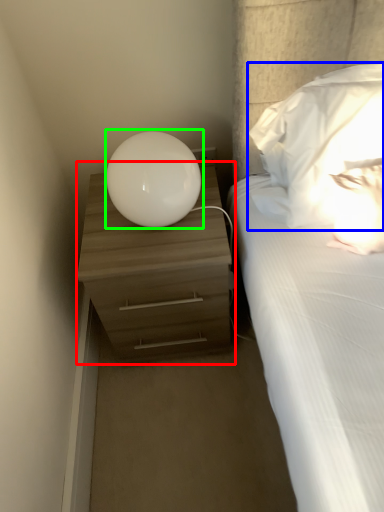
Question: Considering the real-world distances, which object is closest to nightstand (highlighted by a red box)? pillow (highlighted by a blue box) or table lamp (highlighted by a green box).

Choices:
 (A) pillow
 (B) table lamp

Answer: (B)